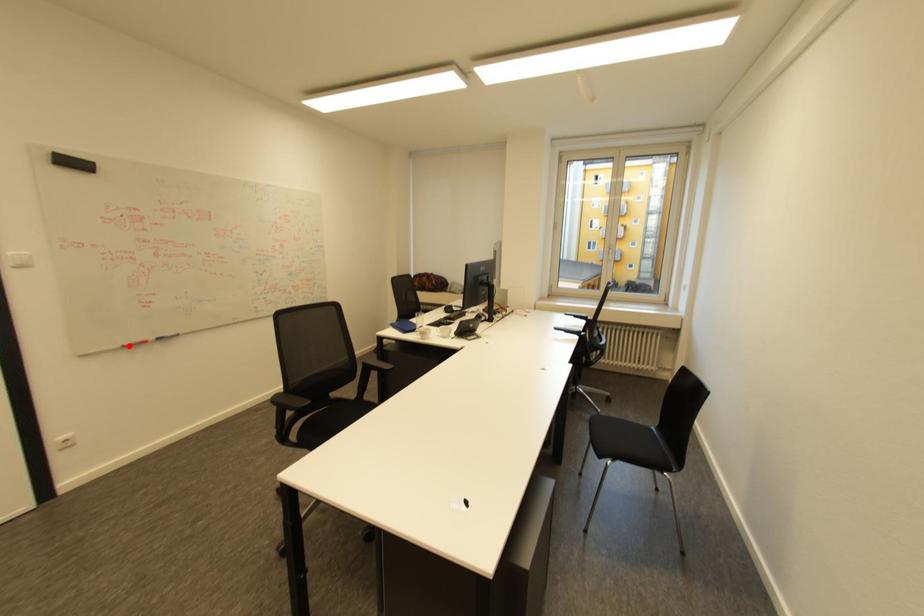
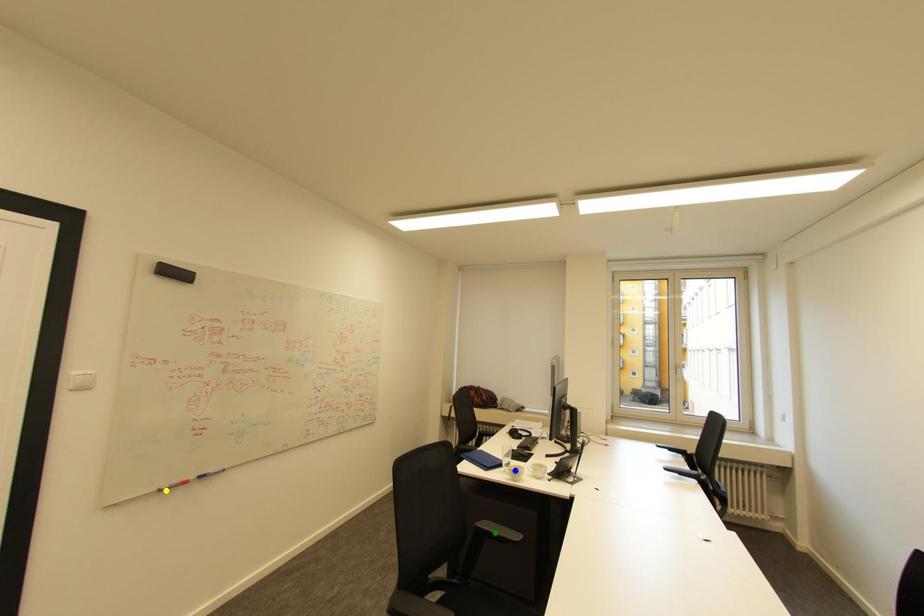
Question: I am providing you with two images of the same scene from different viewpoints. A red point is marked on the first image. You are given multiple points on the second image. In image 2, which mark is for the same physical point as the one in image 1?

Choices:
 (A) green point
 (B) blue point
 (C) yellow point

Answer: (C)